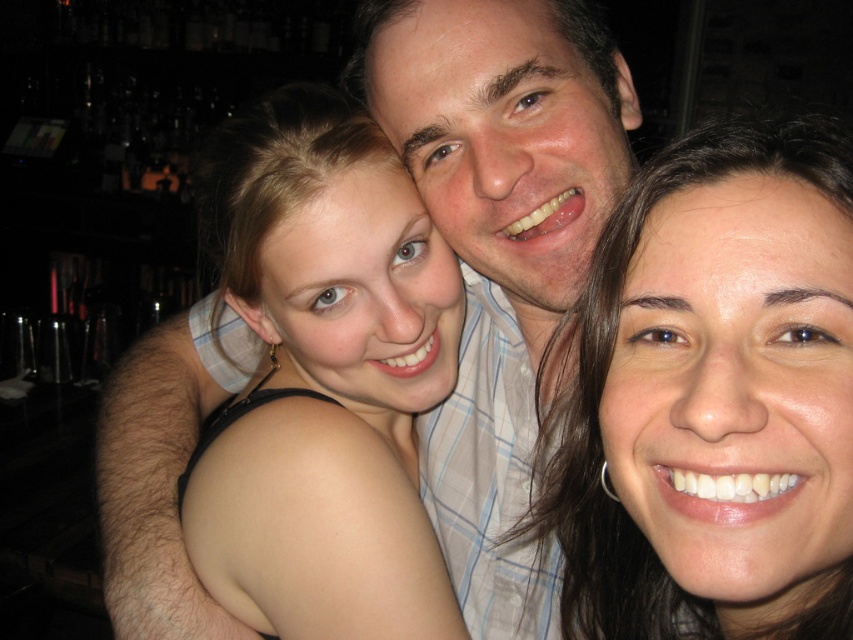
You are taking a photo of the three people in the scene. You want to focus on the closer point between point (x=828, y=634) and point (x=538, y=13). Which point should you focus on?

Point (x=828, y=634) is closer to the viewer than point (x=538, y=13), so you should focus on point (x=828, y=634).

In the scene shown: You are a photographer adjusting the lighting for a portrait. You notice the smooth skin face at center and the smooth skin shoulder at center. Which one should you focus your spotlight on if you want to highlight the subject closest to the camera?

The smooth skin face at center is in front of the smooth skin shoulder at center, so you should focus the spotlight on the smooth skin face at center to highlight the subject closest to the camera.

You are a photographer adjusting the focus on your camera. You want to ensure that both the white plaid shirt at center and the smooth skin shoulder at center are in sharp focus. Given that the depth of field can only cover 4 inches, will both elements be in focus?

The white plaid shirt at center is 4.20 inches away from the smooth skin shoulder at center. Since the depth of field can only cover 4 inches, the distance between them exceeds the depth of field capacity. Therefore, both elements cannot be in focus simultaneously.